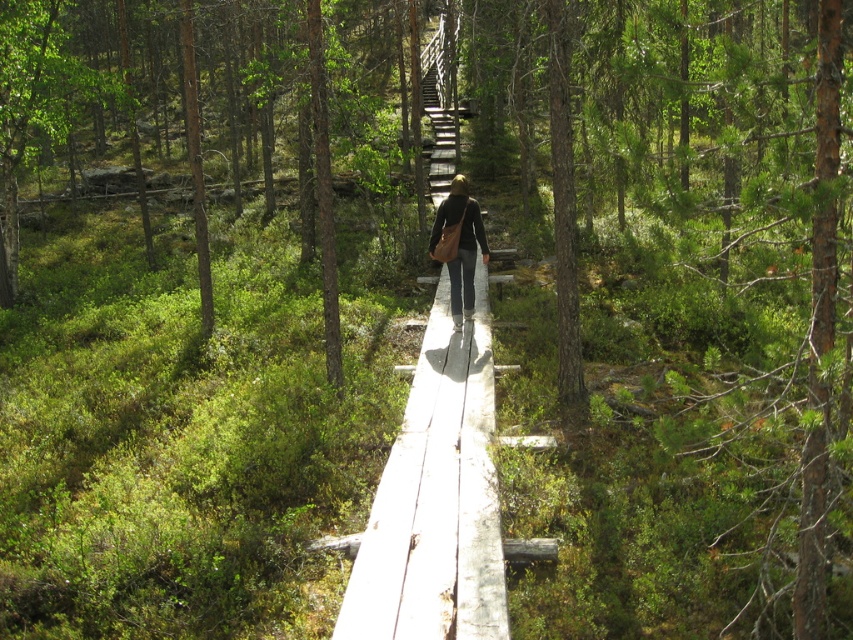
Question: Does wooden stairs at center have a lesser width compared to brown leather bag at center?

Choices:
 (A) no
 (B) yes

Answer: (A)

Question: Which of these objects is positioned closest to the brown leather bag at center?

Choices:
 (A) wooden plank at center
 (B) wooden stairs at center

Answer: (A)

Question: Among these points, which one is nearest to the camera?

Choices:
 (A) (425, 598)
 (B) (438, 195)

Answer: (A)

Question: Is the position of wooden stairs at center more distant than that of brown leather bag at center?

Choices:
 (A) no
 (B) yes

Answer: (B)

Question: Can you confirm if wooden plank at center is positioned above brown leather bag at center?

Choices:
 (A) no
 (B) yes

Answer: (A)

Question: Which object appears closest to the camera in this image?

Choices:
 (A) wooden plank at center
 (B) wooden stairs at center

Answer: (A)